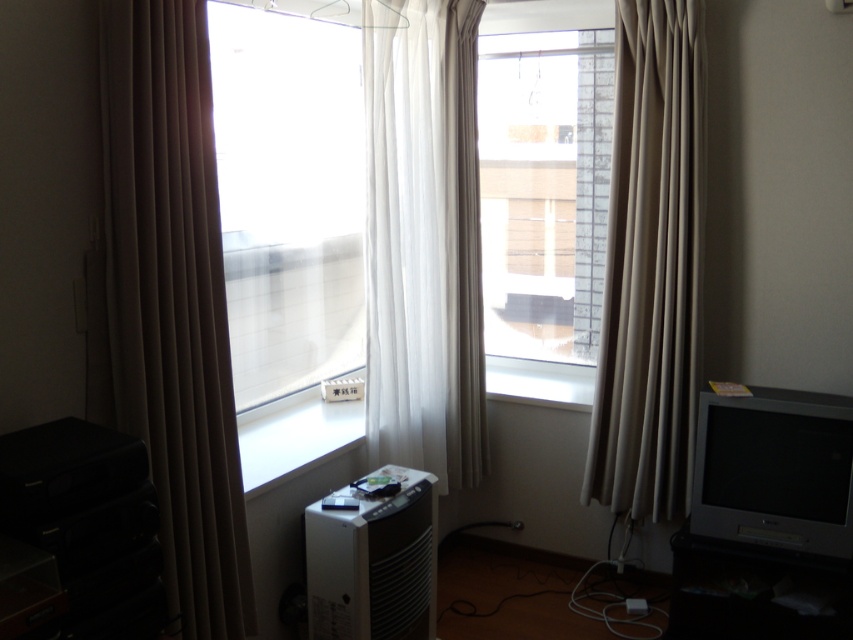
Question: Can you confirm if transparent plastic window at center is bigger than beige fabric curtain at right?

Choices:
 (A) no
 (B) yes

Answer: (B)

Question: Which of the following is the closest to the observer?

Choices:
 (A) (300, 221)
 (B) (627, 108)
 (C) (521, 344)

Answer: (B)

Question: Which of the following is the farthest from the observer?

Choices:
 (A) white sheer curtain at center
 (B) transparent glass window at center
 (C) beige fabric curtain at right

Answer: (B)

Question: Is transparent plastic window at center smaller than transparent glass window at center?

Choices:
 (A) no
 (B) yes

Answer: (A)

Question: Which point is farther from the camera taking this photo?

Choices:
 (A) (527, 138)
 (B) (218, 179)
 (C) (651, 12)

Answer: (A)

Question: Where is transparent plastic window at center located in relation to beige fabric curtain at right in the image?

Choices:
 (A) above
 (B) below

Answer: (A)